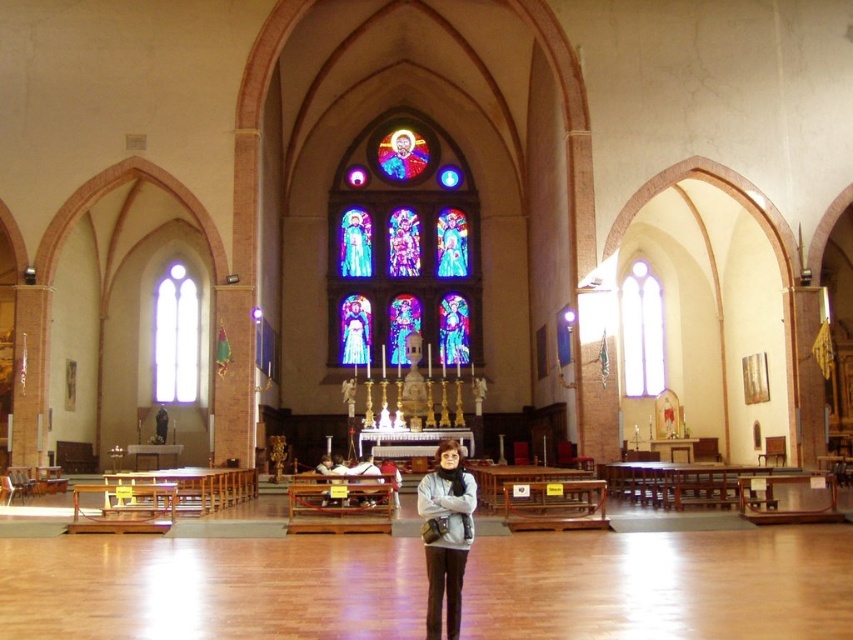
You are standing at the entrance of the church and want to locate the stained glass window at center. Based on its 2D coordinates, in which general direction should you look relative to your position?

The stained glass window at center is located at coordinates approximately 0.384 on the x axis and 0.474 on the y axis. Since the entrance is typically at the front of the church, which would be opposite the altar area at the back, the stained glass window at center is positioned towards the back of the church. Therefore, you should look towards the back of the church to find it.

You are an architect designing a new church and want to replicate the window arrangement seen in the image. Which window should be placed higher in your design, the stained glass window at center or the clear glass window at right?

The stained glass window at center should be placed higher in your design because it is above the clear glass window at right in the original image.